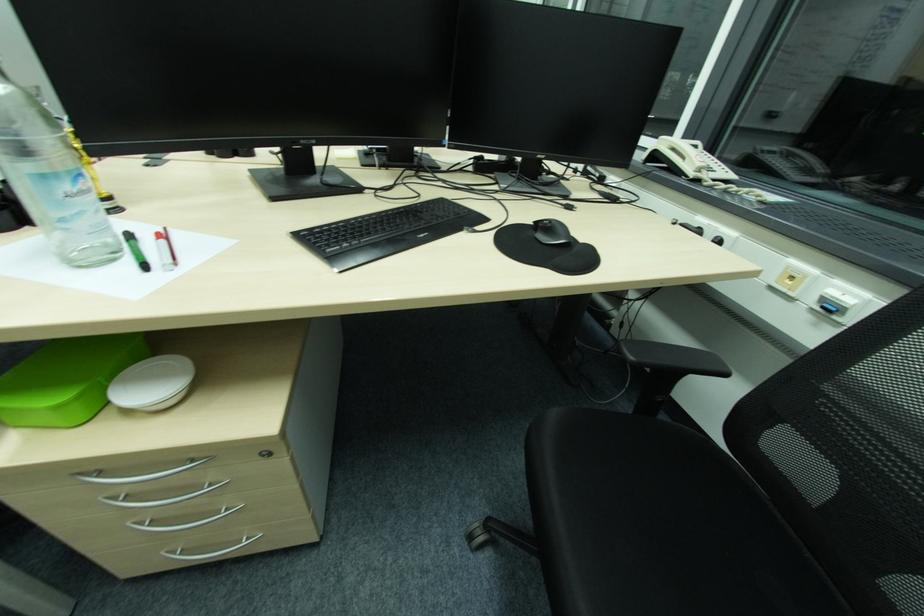
Image resolution: width=924 pixels, height=616 pixels. What do you see at coordinates (161, 498) in the screenshot? I see `the chair sitting surface` at bounding box center [161, 498].